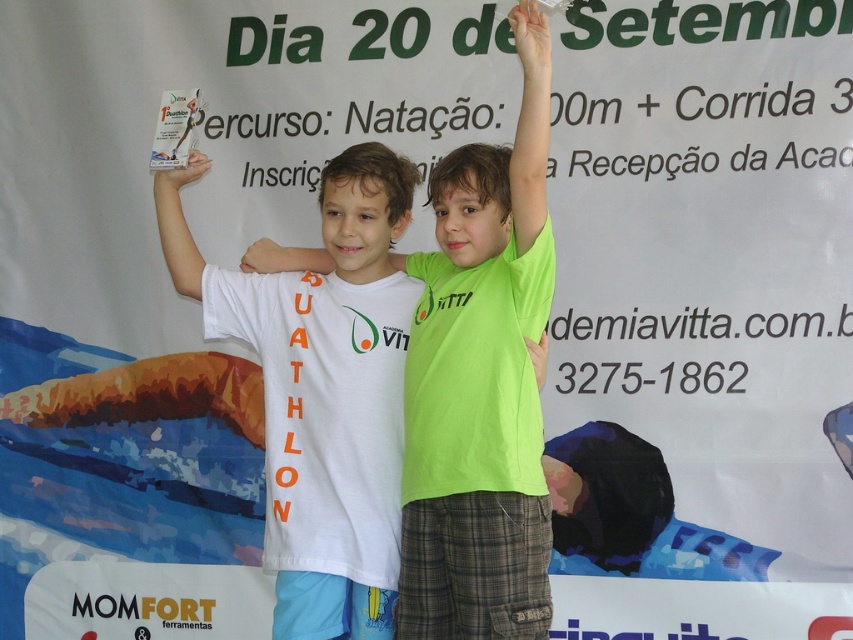
Question: Can you confirm if matte white hand at upper center is positioned to the left of green matte hand at upper center?

Choices:
 (A) yes
 (B) no

Answer: (A)

Question: Which point appears closest to the camera in this image?

Choices:
 (A) (558, 464)
 (B) (535, 342)
 (C) (189, 236)
 (D) (242, 264)

Answer: (B)

Question: Does white cotton t-shirt at center have a smaller size compared to green fabric arm at center?

Choices:
 (A) no
 (B) yes

Answer: (A)

Question: Among these objects, which one is farthest from the camera?

Choices:
 (A) green matte shirt at upper right
 (B) white cotton t-shirt at center
 (C) green matte hand at upper center
 (D) white plastic bottle at upper left

Answer: (D)

Question: Estimate the real-world distances between objects in this image. Which object is farther from the white matte paper at upper left?

Choices:
 (A) matte white hand at upper center
 (B) matte white hand at center

Answer: (A)

Question: Is green fabric arm at center to the right of white plastic bottle at upper left from the viewer's perspective?

Choices:
 (A) yes
 (B) no

Answer: (A)